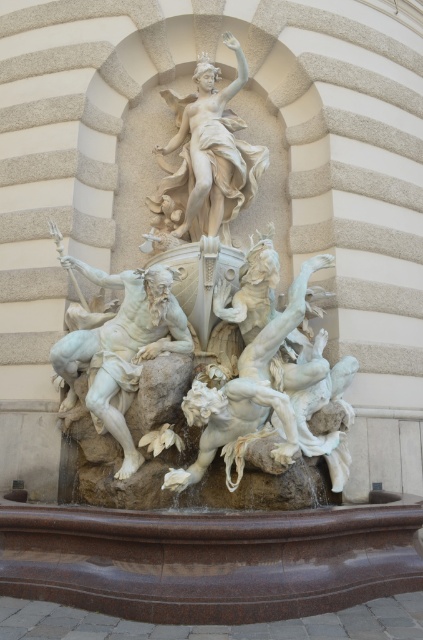
Question: Which of these objects is positioned farthest from the white marble statue at upper center?

Choices:
 (A) white marble figure at center
 (B) white marble statue at center

Answer: (A)

Question: In this image, where is white marble statue at upper center located relative to white marble figure at center?

Choices:
 (A) left
 (B) right

Answer: (B)

Question: From the image, what is the correct spatial relationship of white marble statue at center in relation to white marble statue at upper center?

Choices:
 (A) below
 (B) above

Answer: (A)

Question: Which object is the closest to the white marble statue at upper center?

Choices:
 (A) white marble statue at center
 (B) white marble figure at center

Answer: (A)

Question: Which point is farther to the camera?

Choices:
 (A) white marble figure at center
 (B) white marble statue at center
 (C) white marble statue at upper center

Answer: (C)

Question: Can you confirm if white marble statue at upper center is smaller than white marble figure at center?

Choices:
 (A) no
 (B) yes

Answer: (A)